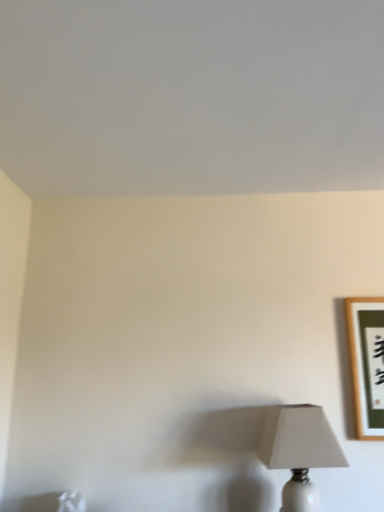
Question: Is white ceramic lamp at lower right wider or thinner than wooden framed artwork at upper right?

Choices:
 (A) wide
 (B) thin

Answer: (A)

Question: Does point (326, 455) appear closer or farther from the camera than point (355, 380)?

Choices:
 (A) farther
 (B) closer

Answer: (B)

Question: From the image's perspective, relative to wooden framed artwork at upper right, is white ceramic lamp at lower right above or below?

Choices:
 (A) above
 (B) below

Answer: (B)

Question: Would you say wooden framed artwork at upper right is inside or outside white ceramic lamp at lower right?

Choices:
 (A) inside
 (B) outside

Answer: (B)

Question: Visually, is wooden framed artwork at upper right positioned to the left or to the right of white ceramic lamp at lower right?

Choices:
 (A) left
 (B) right

Answer: (B)

Question: From the image's perspective, relative to white ceramic lamp at lower right, is wooden framed artwork at upper right above or below?

Choices:
 (A) above
 (B) below

Answer: (A)

Question: Is wooden framed artwork at upper right wider or thinner than white ceramic lamp at lower right?

Choices:
 (A) wide
 (B) thin

Answer: (B)